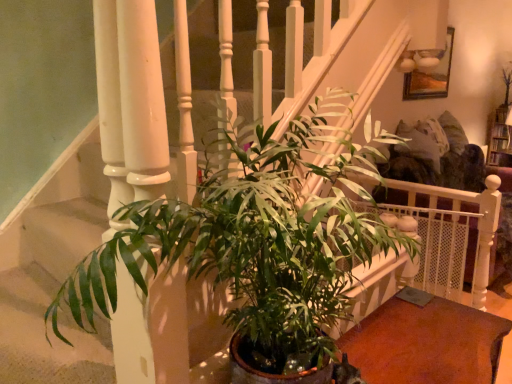
Question: Is smooth brown table at lower right to the left or to the right of green glossy plant at center in the image?

Choices:
 (A) right
 (B) left

Answer: (A)

Question: Is smooth brown table at lower right spatially inside green glossy plant at center, or outside of it?

Choices:
 (A) inside
 (B) outside

Answer: (B)

Question: From a real-world perspective, is smooth brown table at lower right positioned above or below green glossy plant at center?

Choices:
 (A) below
 (B) above

Answer: (A)

Question: Considering the relative positions of green glossy plant at center and smooth brown table at lower right in the image provided, is green glossy plant at center to the left or to the right of smooth brown table at lower right?

Choices:
 (A) right
 (B) left

Answer: (B)

Question: From the image's perspective, is green glossy plant at center above or below smooth brown table at lower right?

Choices:
 (A) above
 (B) below

Answer: (A)

Question: Considering the positions of green glossy plant at center and smooth brown table at lower right in the image, is green glossy plant at center taller or shorter than smooth brown table at lower right?

Choices:
 (A) short
 (B) tall

Answer: (B)

Question: Do you think green glossy plant at center is within smooth brown table at lower right, or outside of it?

Choices:
 (A) outside
 (B) inside

Answer: (A)